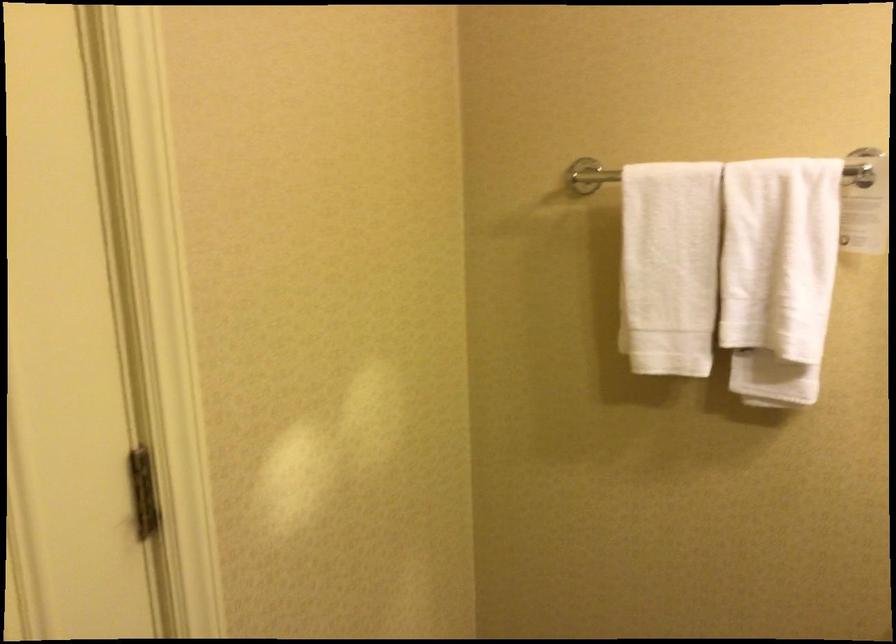
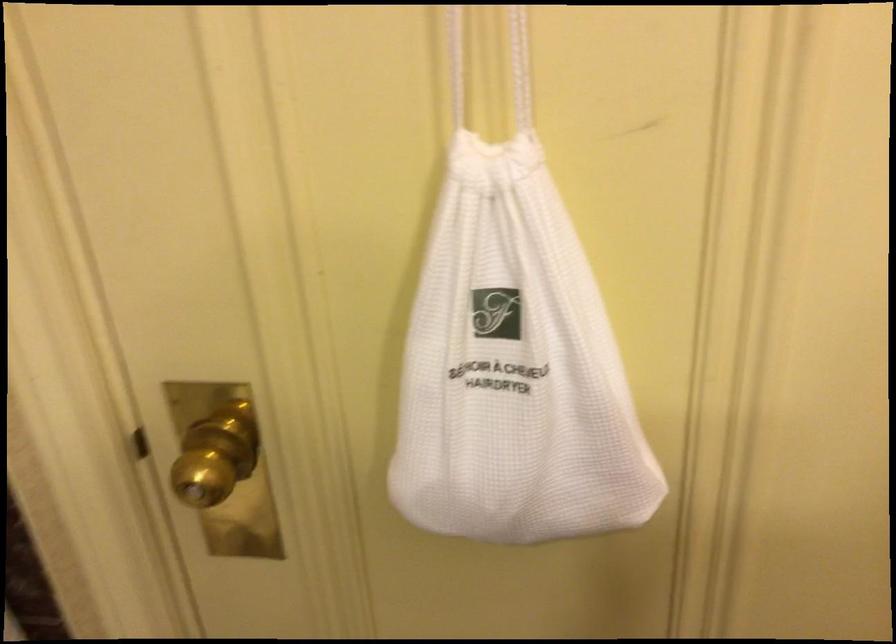
The images are taken continuously from a first-person perspective. In which direction is your viewpoint rotating?

The camera rotated toward left-down.